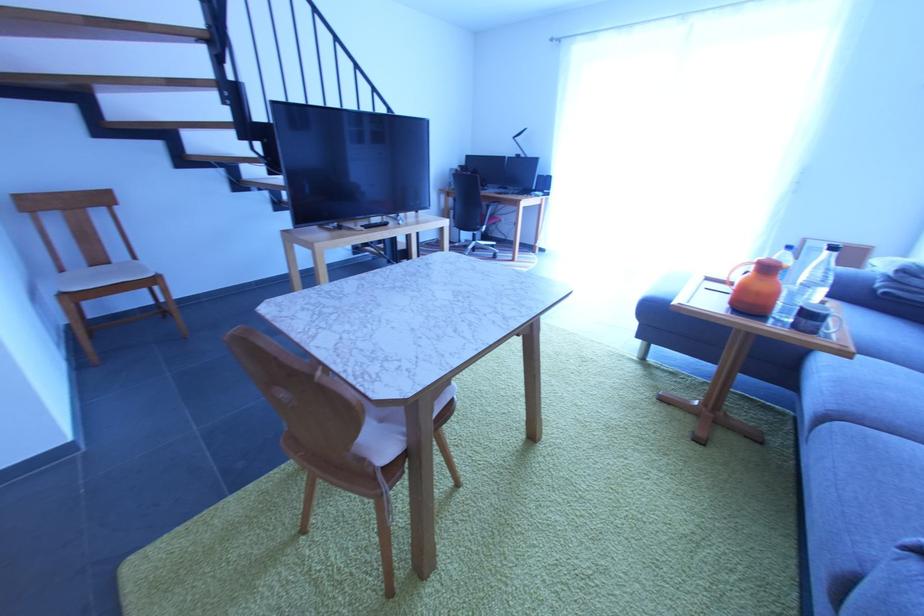
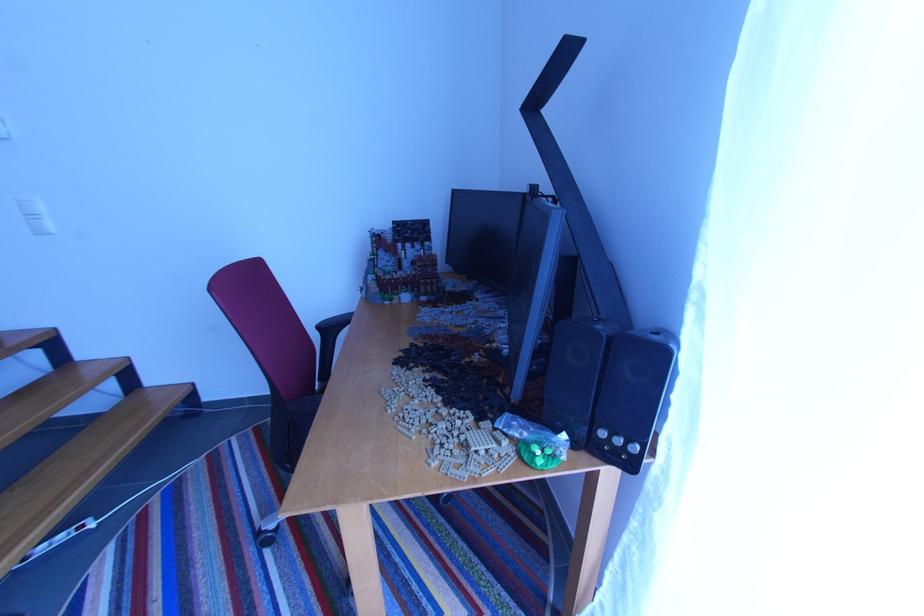
The point at (552, 193) is marked in the first image. Where is the corresponding point in the second image?

(623, 443)